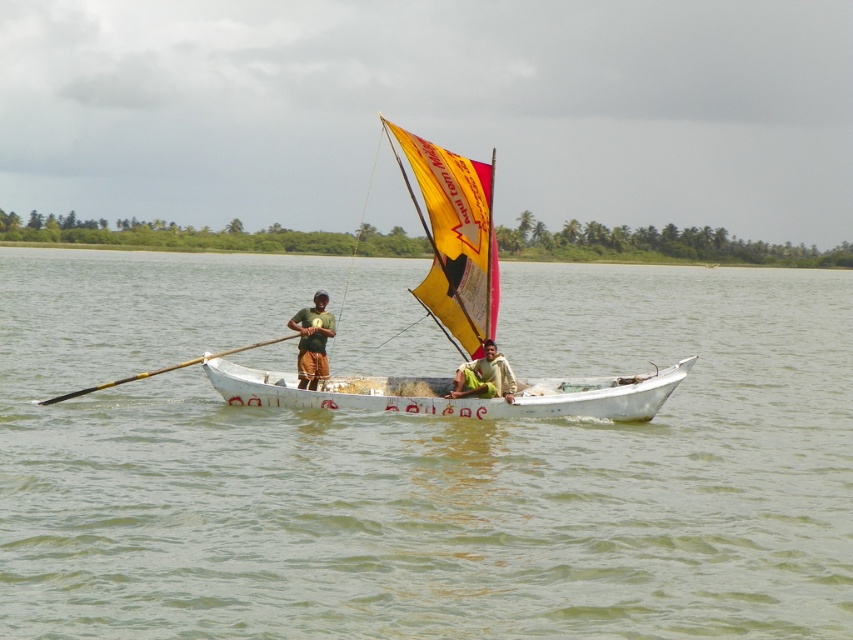
Does white matte canoe at center appear on the right side of light brown woven fabric at center?

No, white matte canoe at center is not to the right of light brown woven fabric at center.

What do you see at coordinates (454, 397) in the screenshot? The width and height of the screenshot is (853, 640). I see `white matte canoe at center` at bounding box center [454, 397].

The image size is (853, 640). What are the coordinates of `white matte canoe at center` in the screenshot? It's located at (454, 397).

Can you confirm if yellow fabric sail at center is positioned above green fabric shirt at center?

Yes, yellow fabric sail at center is above green fabric shirt at center.

Is point (467, 326) positioned in front of point (306, 365)?

No.

I want to click on yellow fabric sail at center, so click(456, 237).

Does light brown woven fabric at center appear on the right side of wooden polished paddle at left?

Yes, light brown woven fabric at center is to the right of wooden polished paddle at left.

Based on the photo, can you confirm if light brown woven fabric at center is positioned to the left of wooden polished paddle at left?

In fact, light brown woven fabric at center is to the right of wooden polished paddle at left.

Image resolution: width=853 pixels, height=640 pixels. Identify the location of light brown woven fabric at center. (485, 376).